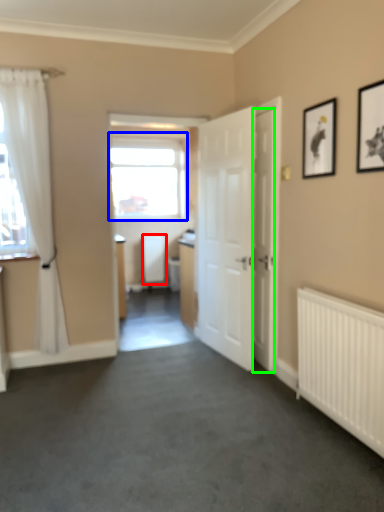
Question: Based on their relative distances, which object is nearer to radiator (highlighted by a red box)? Choose from window (highlighted by a blue box) and door (highlighted by a green box).

Choices:
 (A) window
 (B) door

Answer: (A)